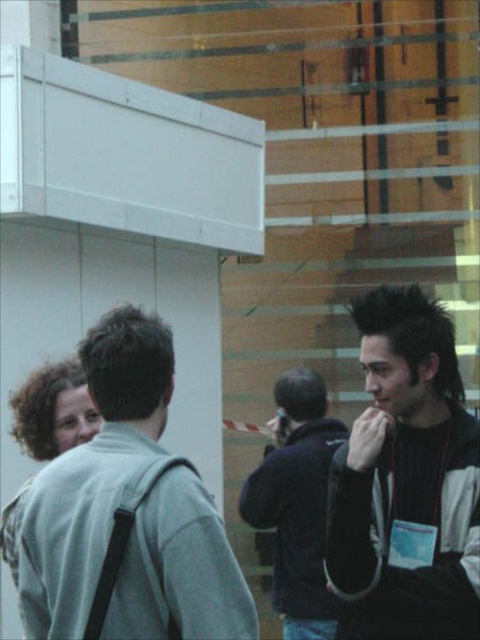
You are a photographer trying to capture a photo of the two jackets in the scene. Since the gray fabric jacket at left and the black matte jacket at right are partially overlapping, which jacket should you focus on to ensure the other is still visible in the background?

The gray fabric jacket at left is in front of the black matte jacket at right, so focusing on the gray fabric jacket at left will keep the black matte jacket at right visible in the background.